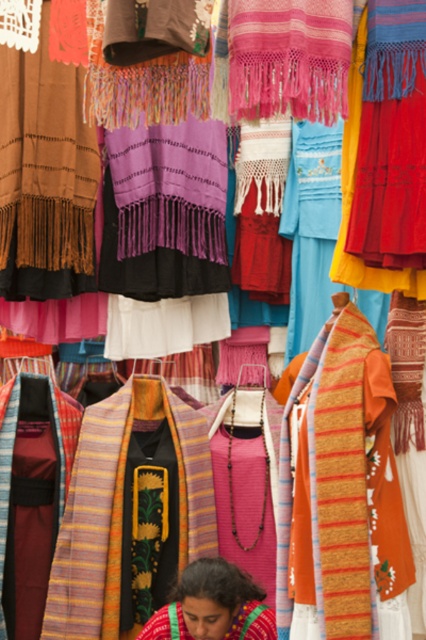
Looking at this image, you are at a market stall and see the embroidered fabric at lower center and the textured orange shawl at center. Which item is positioned to the right of the other?

The embroidered fabric at lower center is to the right of the textured orange shawl at center.

You are standing in front of the vibrant textile display and want to touch the two points mentioned. Which point, point (230, 589) or point (242, 632), is closer to your hand?

Point (230, 589) is closer to the viewer than point (242, 632), so it is closer to your hand.